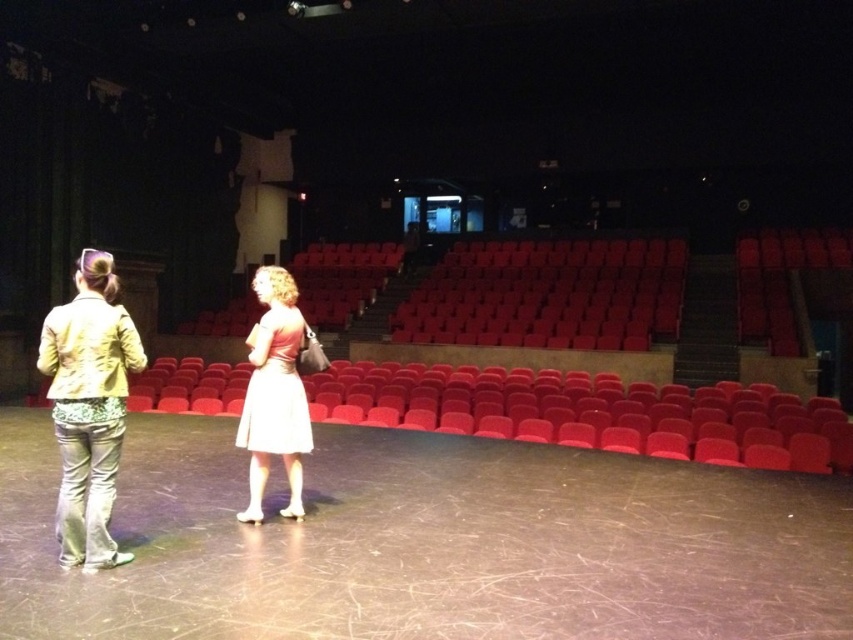
You are an audience member sitting in the front row of the theater. You notice the light yellow fabric jacket at left and the white satin dress at center. Which one is closer to you?

The light yellow fabric jacket at left is closer to you because it is in front of the white satin dress at center.

You are standing in the audience of the indoor theater and looking at the stage. There are two points marked on the stage floor. The first point is at coordinates point [54,316] and the second point is at coordinates point [280,316]. Which point appears closer to you?

Point [54,316] is closer to the camera than point [280,316], so the first point appears closer to you.

You are a stagehand preparing to place a 36 inch wide prop between the light yellow fabric jacket at left and the white satin dress at center. Can the prop fit between them without overlapping either?

The light yellow fabric jacket at left and white satin dress at center are 36.31 inches apart. Since the prop is 36 inches wide, it can fit between them as the space is slightly larger than the prop.